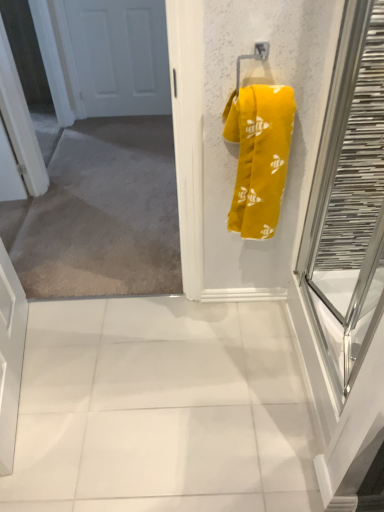
Question: Should I look upward or downward to see white matte door at upper left?

Choices:
 (A) up
 (B) down

Answer: (A)

Question: From a real-world perspective, is clear glass door at right below white matte door at upper left?

Choices:
 (A) yes
 (B) no

Answer: (B)

Question: Is the surface of clear glass door at right in direct contact with white matte door at upper left?

Choices:
 (A) yes
 (B) no

Answer: (B)

Question: Is clear glass door at right outside of white matte door at upper left?

Choices:
 (A) no
 (B) yes

Answer: (B)

Question: Considering the relative sizes of clear glass door at right and white matte door at upper left in the image provided, is clear glass door at right wider than white matte door at upper left?

Choices:
 (A) yes
 (B) no

Answer: (A)

Question: Can you confirm if clear glass door at right is positioned to the right of white matte door at upper left?

Choices:
 (A) no
 (B) yes

Answer: (B)

Question: From the image's perspective, is clear glass door at right on top of white matte door at upper left?

Choices:
 (A) yes
 (B) no

Answer: (B)

Question: Is white glossy tile at center turned away from yellow fabric towel at upper right?

Choices:
 (A) yes
 (B) no

Answer: (B)

Question: Can you confirm if white glossy tile at center is positioned to the right of yellow fabric towel at upper right?

Choices:
 (A) yes
 (B) no

Answer: (B)

Question: Can you confirm if white glossy tile at center is shorter than yellow fabric towel at upper right?

Choices:
 (A) yes
 (B) no

Answer: (A)

Question: Does white glossy tile at center have a greater height compared to yellow fabric towel at upper right?

Choices:
 (A) yes
 (B) no

Answer: (B)

Question: From the image's perspective, is white glossy tile at center located beneath yellow fabric towel at upper right?

Choices:
 (A) yes
 (B) no

Answer: (A)

Question: Is white glossy tile at center not close to yellow fabric towel at upper right?

Choices:
 (A) yes
 (B) no

Answer: (B)

Question: Is white glossy tile at center facing towards white matte door at upper left?

Choices:
 (A) yes
 (B) no

Answer: (B)